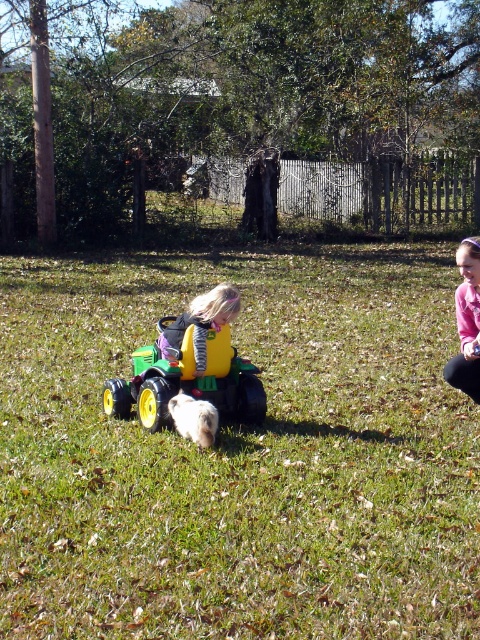
You are a parent looking for your child who is playing in the backyard. You see the green plastic tractor at center and the pink fleece jacket at right. Which object is closer to the left side of the scene?

The green plastic tractor at center is closer to the left side of the scene as it is positioned to the left of the pink fleece jacket at right.

You are a drone operator trying to capture a photo of the green grass at center and the matte yellow toy at center. From above, which object would appear lower in the image?

The green grass at center is located below the matte yellow toy at center, so it would appear lower in the image.